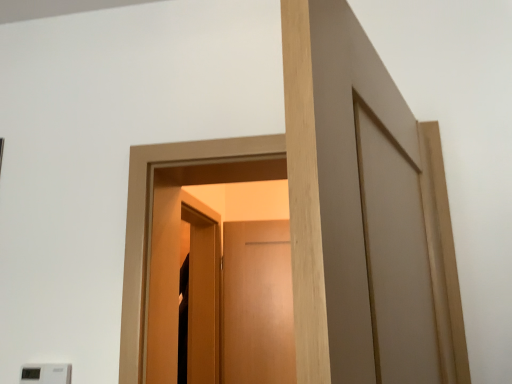
Question: From the image's perspective, is white plastic light switch at lower left positioned above or below matte wood screen door at center?

Choices:
 (A) above
 (B) below

Answer: (A)

Question: In the image, is white plastic light switch at lower left positioned in front of or behind matte wood screen door at center?

Choices:
 (A) front
 (B) behind

Answer: (A)

Question: Is white plastic light switch at lower left inside the boundaries of matte wood screen door at center, or outside?

Choices:
 (A) inside
 (B) outside

Answer: (B)

Question: In the image, is matte wood screen door at center positioned in front of or behind white plastic light switch at lower left?

Choices:
 (A) front
 (B) behind

Answer: (B)

Question: Is point (202, 278) closer or farther from the camera than point (40, 380)?

Choices:
 (A) farther
 (B) closer

Answer: (A)

Question: From a real-world perspective, is matte wood screen door at center above or below white plastic light switch at lower left?

Choices:
 (A) above
 (B) below

Answer: (A)

Question: Considering the positions of matte wood screen door at center and white plastic light switch at lower left in the image, is matte wood screen door at center taller or shorter than white plastic light switch at lower left?

Choices:
 (A) short
 (B) tall

Answer: (B)